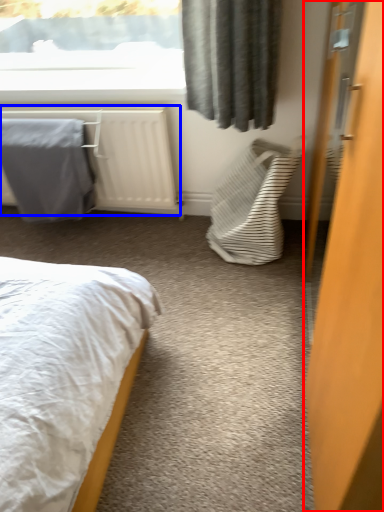
Question: Which object is closer to the camera taking this photo, door (highlighted by a red box) or radiator (highlighted by a blue box)?

Choices:
 (A) door
 (B) radiator

Answer: (A)